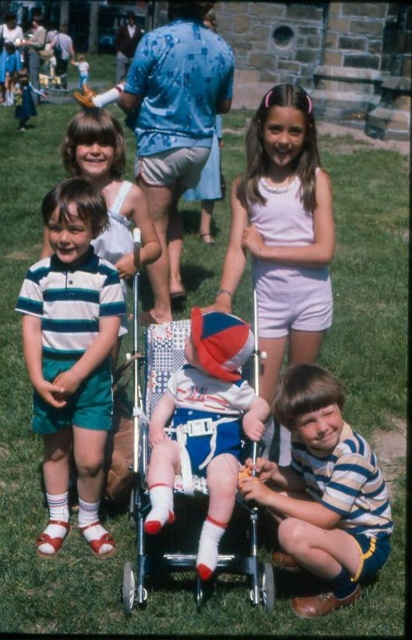
Consider the image. You are a photographer trying to capture a candid shot of the children in the scene. You want to focus on the white cotton dress at center. Based on its coordinates, where should you aim your camera to ensure it is centered in your viewfinder?

You should aim your camera at point 0.362 on the horizontal axis and point 0.684 on the vertical axis to center the white cotton dress at center in your viewfinder.

You are a photographer trying to capture a group photo of the children. You notice the white cotton dress at center and the matte blue shirt at center. Which clothing item would appear narrower in the photo?

The white cotton dress at center is thinner than the matte blue shirt at center, so it would appear narrower in the photo.